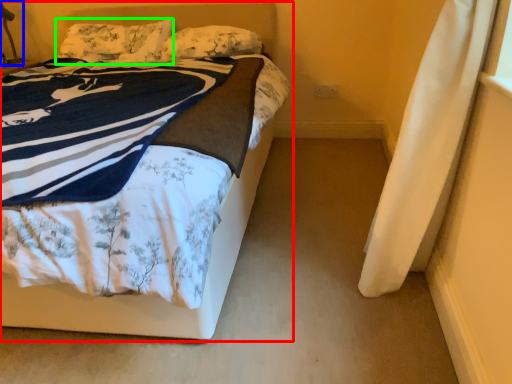
Question: Considering the real-world distances, which object is farthest from bed (highlighted by a red box)? table lamp (highlighted by a blue box) or pillow (highlighted by a green box)?

Choices:
 (A) table lamp
 (B) pillow

Answer: (A)